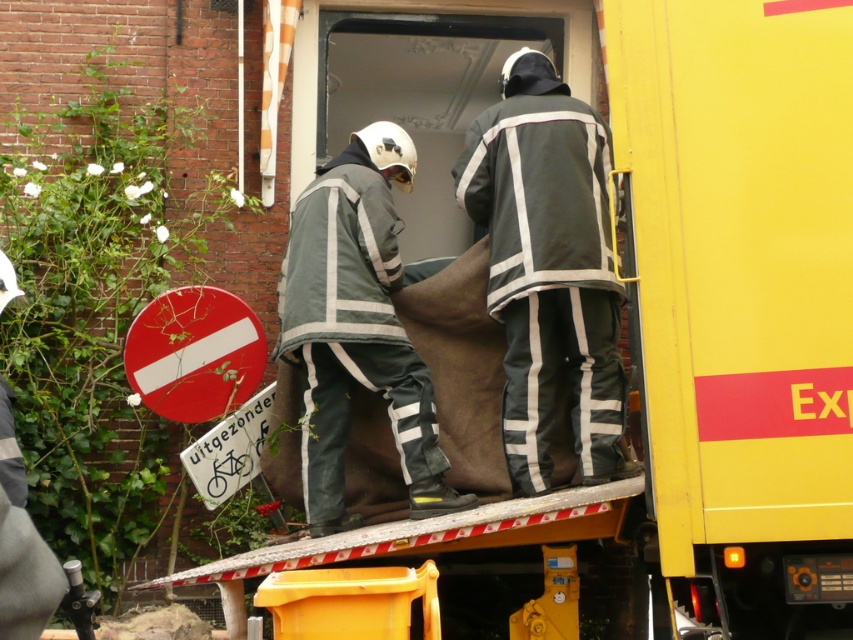
Based on the photo, you are a delivery person standing 6 meters away from the dark green fabric suit at center. Can you reach it without moving closer?

The dark green fabric suit at center is 5.85 meters from the camera, so you are standing 6 meters away. Since 6 meters is slightly farther than 5.85 meters, you cannot reach it without moving closer.